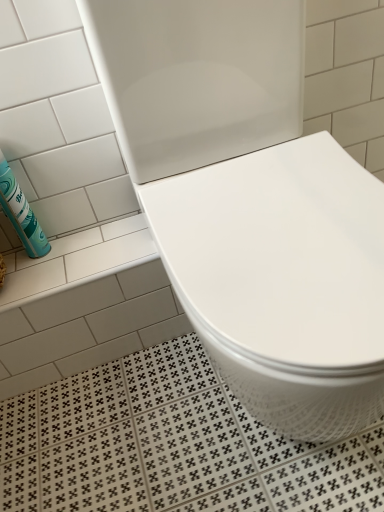
Identify the location of vacant area that is in front of teal matte canister at left. (41, 281).